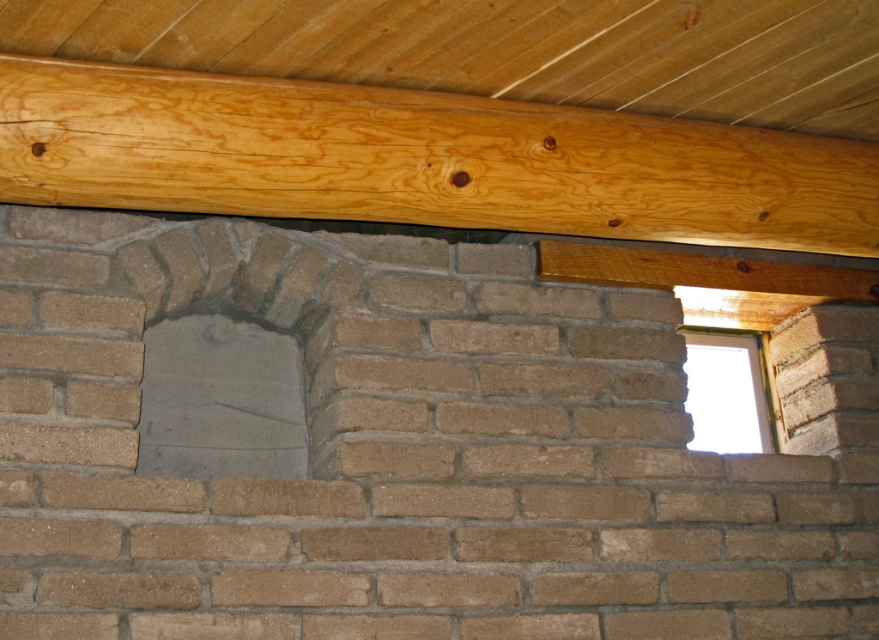
Question: Which object is the closest to the transparent glass window at upper right?

Choices:
 (A) gray concrete hole at center
 (B) natural wood beam at upper center

Answer: (B)

Question: Which of the following is the farthest from the observer?

Choices:
 (A) gray concrete hole at center
 (B) transparent glass window at upper right

Answer: (B)

Question: Is natural wood beam at upper center positioned in front of transparent glass window at upper right?

Choices:
 (A) yes
 (B) no

Answer: (A)

Question: Is natural wood beam at upper center to the right of gray concrete hole at center from the viewer's perspective?

Choices:
 (A) yes
 (B) no

Answer: (A)

Question: Is natural wood beam at upper center to the left of transparent glass window at upper right from the viewer's perspective?

Choices:
 (A) yes
 (B) no

Answer: (A)

Question: Based on their relative distances, which object is nearer to the gray concrete hole at center?

Choices:
 (A) natural wood beam at upper center
 (B) transparent glass window at upper right

Answer: (A)